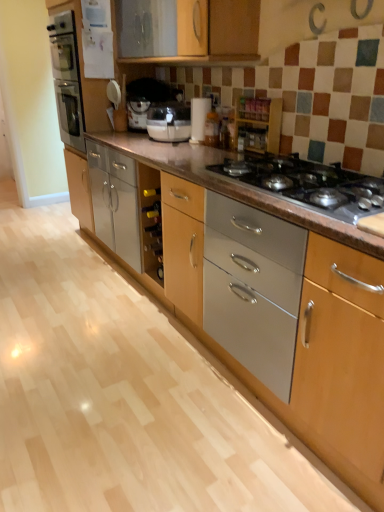
Question: Is white paper towel holder at center taller or shorter than wooden spice rack at upper center?

Choices:
 (A) tall
 (B) short

Answer: (A)

Question: Relative to wooden spice rack at upper center, is white paper towel holder at center in front or behind?

Choices:
 (A) behind
 (B) front

Answer: (A)

Question: Which is farther from the metallic gray gas stove at center?

Choices:
 (A) wooden spice rack at upper center
 (B) white plastic coffee machine at center
 (C) white paper towel holder at center

Answer: (B)

Question: Estimate the real-world distances between objects in this image. Which object is closer to the wooden spice rack at upper center?

Choices:
 (A) metallic gray gas stove at center
 (B) white paper towel holder at center
 (C) white plastic coffee machine at center

Answer: (B)